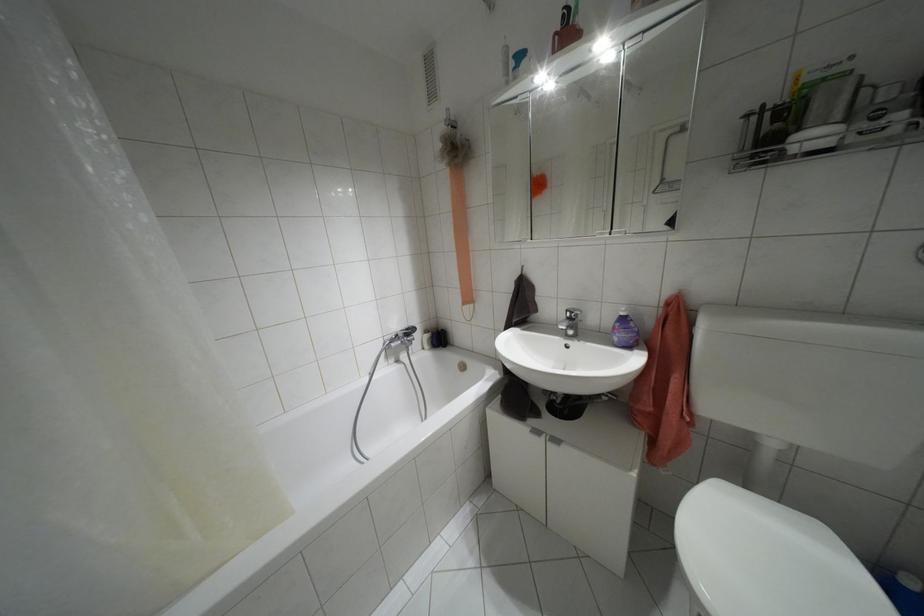
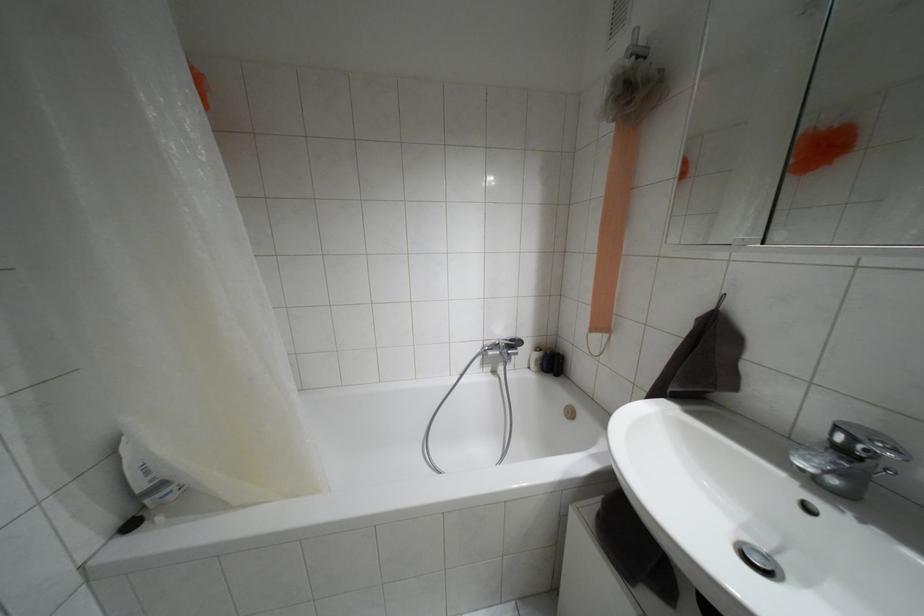
Question: Based on the continuous images, in which direction is the camera rotating? Reply with the corresponding letter.

Choices:
 (A) Left
 (B) Right
 (C) Up
 (D) Down

Answer: (A)